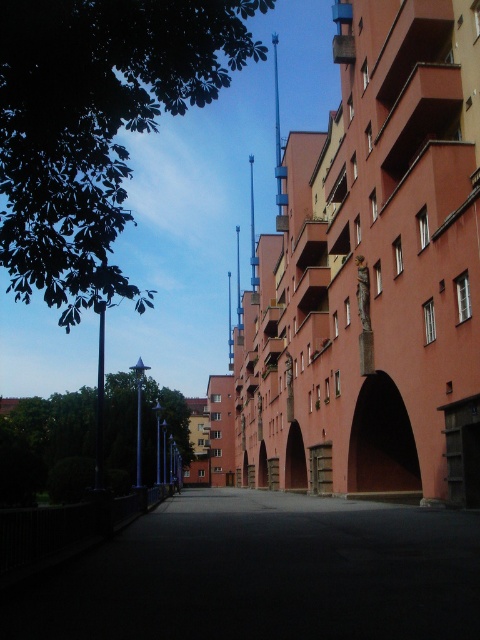
Which is above, green leafy tree at left or dark matte archway at center?

dark matte archway at center is above.

Can you confirm if green leafy tree at left is positioned to the left of dark matte archway at center?

Correct, you'll find green leafy tree at left to the left of dark matte archway at center.

Measure the distance between green leafy tree at left and camera.

green leafy tree at left is 14.60 meters away from camera.

What are the coordinates of `green leafy tree at left` in the screenshot? It's located at (48, 448).

Who is positioned more to the right, dark concrete alley at center or green leafy tree at left?

Positioned to the right is dark concrete alley at center.

Is dark concrete alley at center thinner than green leafy tree at left?

Yes.

Locate an element on the screen. The width and height of the screenshot is (480, 640). dark concrete alley at center is located at coordinates (264, 572).

Which is in front, point (83, 44) or point (396, 486)?

Point (83, 44) is in front.

Can you confirm if green leafy tree at upper left is shorter than dark matte archway at center?

No.

Between point (84, 304) and point (367, 442), which one is positioned behind?

The point (367, 442) is more distant.

You are a GUI agent. You are given a task and a screenshot of the screen. Output one action in this format:
    pyautogui.click(x=<x>, y=<y>)
    Task: Click on the green leafy tree at upper left
    
    Given the screenshot: What is the action you would take?
    pyautogui.click(x=96, y=125)